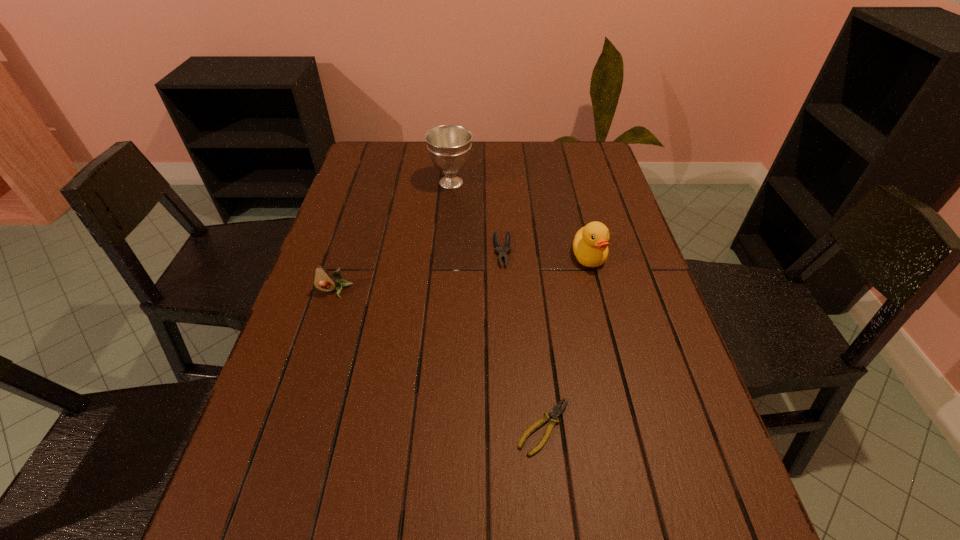
Locate an element on the screen. free spot between the fourth tallest object and the shortest object is located at coordinates (523, 339).

The image size is (960, 540). Identify the location of free space that is in between the taller pliers and the fourth farthest object. (419, 271).

In order to click on object identified as the closest to the farthest object in this screenshot , I will do `click(498, 249)`.

Where is `object that is the fourth closest to the tallest object`? This screenshot has width=960, height=540. object that is the fourth closest to the tallest object is located at coordinates (555, 412).

Where is `free space that satisfies the following two spatial constraints: 1. at the gripping part of the shorter pliers; 2. on the right side of the taller pliers`? This screenshot has height=540, width=960. free space that satisfies the following two spatial constraints: 1. at the gripping part of the shorter pliers; 2. on the right side of the taller pliers is located at coordinates (512, 427).

Where is `vacant region that satisfies the following two spatial constraints: 1. at the gripping part of the nearer pliers; 2. on the right side of the farther pliers`? The height and width of the screenshot is (540, 960). vacant region that satisfies the following two spatial constraints: 1. at the gripping part of the nearer pliers; 2. on the right side of the farther pliers is located at coordinates (512, 427).

Find the location of a particular element. The height and width of the screenshot is (540, 960). free space that satisfies the following two spatial constraints: 1. at the gripping part of the second shortest object; 2. on the right side of the nearer pliers is located at coordinates (512, 427).

Where is `free location that satisfies the following two spatial constraints: 1. on the seed side of the nearest object; 2. on the left side of the third tallest object`? The height and width of the screenshot is (540, 960). free location that satisfies the following two spatial constraints: 1. on the seed side of the nearest object; 2. on the left side of the third tallest object is located at coordinates (292, 427).

Identify the location of vacant space that satisfies the following two spatial constraints: 1. at the gripping part of the taller pliers; 2. on the right side of the nearer pliers. (512, 427).

Find the location of `free spot that satisfies the following two spatial constraints: 1. at the gripping part of the farther pliers; 2. on the right side of the nearer pliers`. free spot that satisfies the following two spatial constraints: 1. at the gripping part of the farther pliers; 2. on the right side of the nearer pliers is located at coordinates (512, 427).